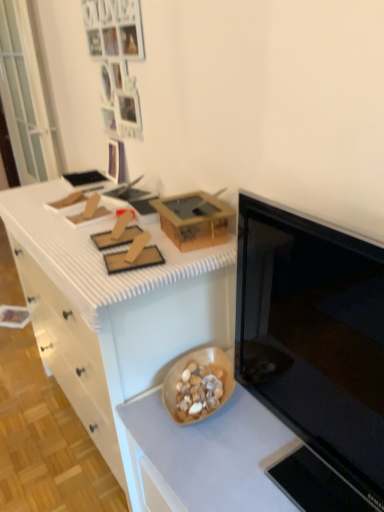
What do you see at coordinates (314, 335) in the screenshot?
I see `black glossy microwave at right` at bounding box center [314, 335].

What is the approximate width of matte brown cardboard box at center?

The width of matte brown cardboard box at center is 5.64 inches.

What do you see at coordinates (68, 359) in the screenshot? I see `white matte drawer at left` at bounding box center [68, 359].

What do you see at coordinates (199, 391) in the screenshot?
I see `wooden bowl at lower center` at bounding box center [199, 391].

In order to click on black glossy microwave at right in this screenshot , I will do `click(314, 335)`.

At what (x,y) coordinates should I click in order to perform the action: click on countertop lying below the wooden bowl at lower center (from the image's perspective). Please return your answer as a coordinate pair (x, y). Looking at the image, I should click on (206, 456).

In the scene shown: From the image's perspective, is wooden bowl at lower center, the first countertop when ordered from bottom to top, positioned above or below wooden bowl at lower center?

From the image's perspective, wooden bowl at lower center, the first countertop when ordered from bottom to top, appears below wooden bowl at lower center.

Between wooden bowl at lower center, the first countertop when ordered from bottom to top, and wooden bowl at lower center, which one is positioned behind?

wooden bowl at lower center.

How different are the orientations of wooden bowl at lower center, the first countertop when ordered from bottom to top, and wooden bowl at lower center in degrees?

There is a 29.2-degree angle between the facing directions of wooden bowl at lower center, the first countertop when ordered from bottom to top, and wooden bowl at lower center.

From a real-world perspective, does white matte drawer at left sit lower than white matte cabinet at upper left?

Yes, from a real-world perspective, white matte drawer at left is beneath white matte cabinet at upper left.

Is white matte drawer at left outside of white matte cabinet at upper left?

That's correct, white matte drawer at left is outside of white matte cabinet at upper left.

Is white matte drawer at left positioned far away from white matte cabinet at upper left?

No.

Is white matte drawer at left wider or thinner than wooden bowl at lower center?

Considering their sizes, white matte drawer at left looks broader than wooden bowl at lower center.

Does white matte drawer at left touch wooden bowl at lower center?

white matte drawer at left is not next to wooden bowl at lower center, and they're not touching.

Considering the sizes of objects white matte drawer at left and wooden bowl at lower center in the image provided, who is bigger, white matte drawer at left or wooden bowl at lower center?

With larger size is white matte drawer at left.

Which is more to the left, white matte drawer at left or wooden bowl at lower center?

Positioned to the left is white matte drawer at left.

Is wooden bowl at lower center bigger or smaller than black glossy microwave at right?

Clearly, wooden bowl at lower center is smaller in size than black glossy microwave at right.

In the scene shown: Is wooden bowl at lower center facing towards black glossy microwave at right?

No, wooden bowl at lower center is not oriented towards black glossy microwave at right.

From a real-world perspective, does wooden bowl at lower center sit lower than black glossy microwave at right?

Yes.

Is wooden bowl at lower center not inside black glossy microwave at right?

Indeed, wooden bowl at lower center is completely outside black glossy microwave at right.

You are a GUI agent. You are given a task and a screenshot of the screen. Output one action in this format:
    pyautogui.click(x=<x>, y=<y>)
    Task: Click on the countertop beneath the white matte cabinet at upper left (from a real-world perspective)
    This screenshot has height=512, width=384.
    Given the screenshot: What is the action you would take?
    pyautogui.click(x=206, y=456)

Can you tell me how much wooden bowl at lower center, the first countertop when ordered from bottom to top, and white matte cabinet at upper left differ in facing direction?

1.05 degrees.

Between wooden bowl at lower center, the first countertop when ordered from bottom to top, and white matte cabinet at upper left, which one has less height?

wooden bowl at lower center, the first countertop when ordered from bottom to top, is shorter.

Is white textured countertop at upper left, the first countertop viewed from the top, aimed at matte brown cardboard box at center?

No, white textured countertop at upper left, the first countertop viewed from the top, is not turned towards matte brown cardboard box at center.

Is white textured countertop at upper left, the first countertop viewed from the top, beside matte brown cardboard box at center?

Answer: No, white textured countertop at upper left, the first countertop viewed from the top, is not touching matte brown cardboard box at center.

Which is nearer, (118, 292) or (178, 245)?

The point (118, 292) is in front.

Who is taller, white textured countertop at upper left, the 2th countertop positioned from the bottom, or black glossy microwave at right?

Standing taller between the two is black glossy microwave at right.

Considering their positions, is white textured countertop at upper left, the 2th countertop positioned from the bottom, located in front of or behind black glossy microwave at right?

Clearly, white textured countertop at upper left, the 2th countertop positioned from the bottom, is behind black glossy microwave at right.

Image resolution: width=384 pixels, height=512 pixels. What are the coordinates of `countertop that appears above the black glossy microwave at right (from a real-world perspective)` in the screenshot? It's located at (95, 253).

This screenshot has width=384, height=512. I want to click on countertop located below the wooden bowl at lower center (from the image's perspective), so click(x=206, y=456).

Find the location of a particular element. cabinetry in front of the white matte drawer at left is located at coordinates (113, 311).

Based on their spatial positions, is white textured countertop at upper left, the 2th countertop positioned from the bottom, or wooden bowl at lower center further from matte brown cardboard box at center?

wooden bowl at lower center is positioned further to the anchor matte brown cardboard box at center.

From the image, which object appears to be farther from white textured countertop at upper left, the 2th countertop positioned from the bottom, white matte drawer at left or black glossy microwave at right?

The object further to white textured countertop at upper left, the 2th countertop positioned from the bottom, is black glossy microwave at right.

In the scene shown: Which object lies nearer to the anchor point white matte drawer at left, wooden bowl at lower center or white matte cabinet at upper left?

Based on the image, white matte cabinet at upper left appears to be nearer to white matte drawer at left.

Which object lies further to the anchor point white matte drawer at left, wooden bowl at lower center, the first countertop when ordered from bottom to top, or black glossy microwave at right?

black glossy microwave at right is positioned further to the anchor white matte drawer at left.

Considering their positions, is wooden bowl at lower center, which is the 2th countertop from top to bottom, positioned closer to wooden bowl at lower center than white matte cabinet at upper left?

Among the two, wooden bowl at lower center, which is the 2th countertop from top to bottom, is located nearer to wooden bowl at lower center.

Based on their spatial positions, is white matte drawer at left or wooden bowl at lower center further from white matte cabinet at upper left?

wooden bowl at lower center is positioned further to the anchor white matte cabinet at upper left.

Looking at the image, which one is located closer to wooden bowl at lower center, the first countertop when ordered from bottom to top, transparent glass door at left or matte brown cardboard box at center?

Based on the image, matte brown cardboard box at center appears to be nearer to wooden bowl at lower center, the first countertop when ordered from bottom to top.

When comparing their distances from wooden bowl at lower center, does white matte drawer at left or white matte cabinet at upper left seem closer?

white matte cabinet at upper left is closer to wooden bowl at lower center.

At what (x,y) coordinates should I click in order to perform the action: click on cabinetry located between white matte drawer at left and matte brown cardboard box at center in the left-right direction. Please return your answer as a coordinate pair (x, y). Image resolution: width=384 pixels, height=512 pixels. Looking at the image, I should click on 113,311.

Locate an element on the screen. The height and width of the screenshot is (512, 384). cabinetry positioned between black glossy microwave at right and wooden bowl at lower center from near to far is located at coordinates (113, 311).

Locate an element on the screen. The width and height of the screenshot is (384, 512). food between white matte cabinet at upper left and wooden bowl at lower center, which is the 2th countertop from top to bottom, in the horizontal direction is located at coordinates (199, 391).

This screenshot has height=512, width=384. I want to click on food positioned between black glossy microwave at right and transparent glass door at left from near to far, so click(x=199, y=391).